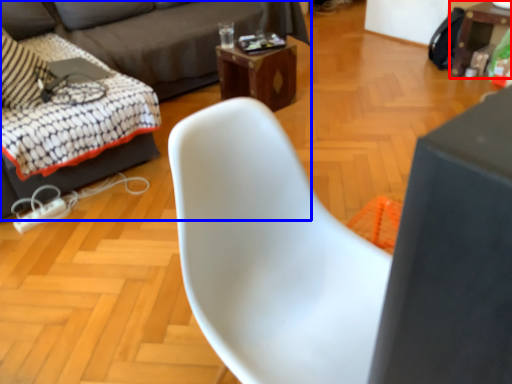
Question: Which of the following is the farthest to the observer, table (highlighted by a red box) or studio couch (highlighted by a blue box)?

Choices:
 (A) table
 (B) studio couch

Answer: (A)